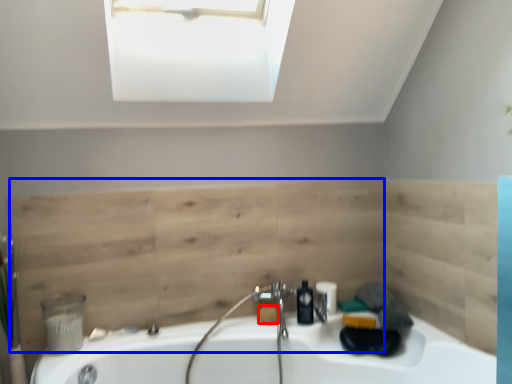
Question: Which object appears farthest to the camera in this image, soap (highlighted by a red box) or plywood (highlighted by a blue box)?

Choices:
 (A) soap
 (B) plywood

Answer: (A)